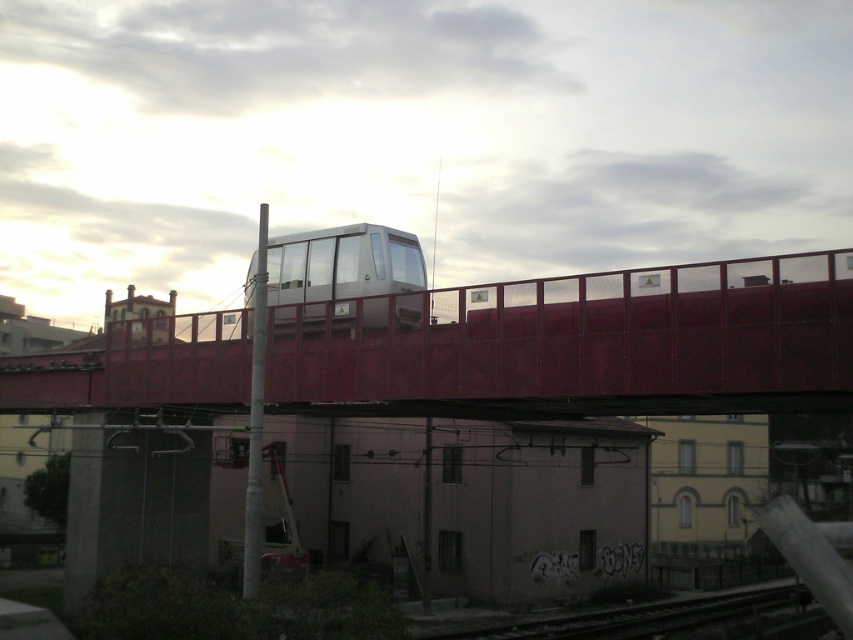
Question: Is metallic silver train at center thinner than metallic train track at lower center?

Choices:
 (A) no
 (B) yes

Answer: (B)

Question: Is metallic red bridge at center behind metallic silver train at center?

Choices:
 (A) no
 (B) yes

Answer: (A)

Question: Which point appears closest to the camera in this image?

Choices:
 (A) (339, 250)
 (B) (540, 292)
 (C) (599, 616)

Answer: (B)

Question: Which is farther from the metallic red bridge at center?

Choices:
 (A) metallic silver train at center
 (B) metallic train track at lower center

Answer: (B)

Question: Is the position of metallic red bridge at center less distant than that of metallic train track at lower center?

Choices:
 (A) no
 (B) yes

Answer: (B)

Question: Considering the real-world distances, which object is closest to the metallic red bridge at center?

Choices:
 (A) metallic silver train at center
 (B) metallic train track at lower center

Answer: (A)